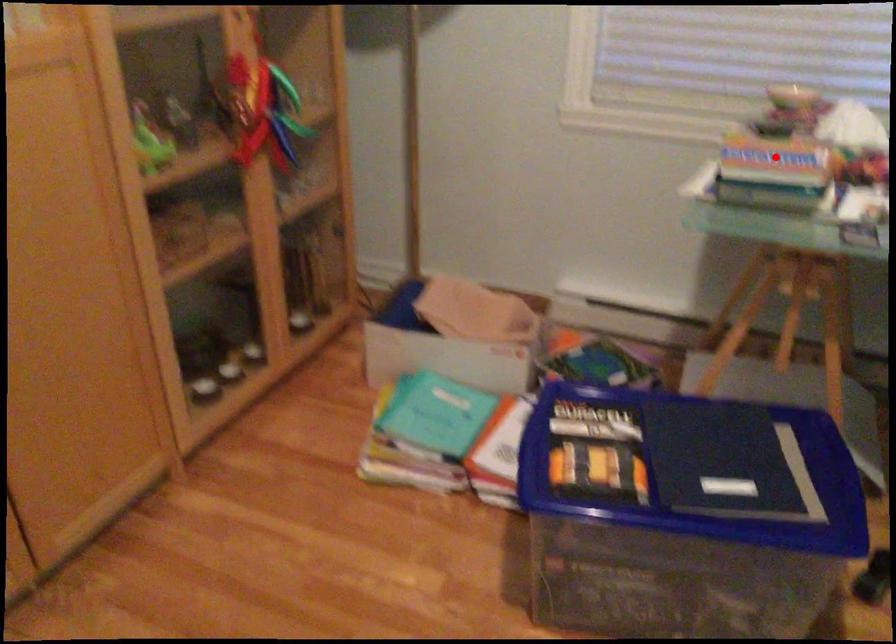
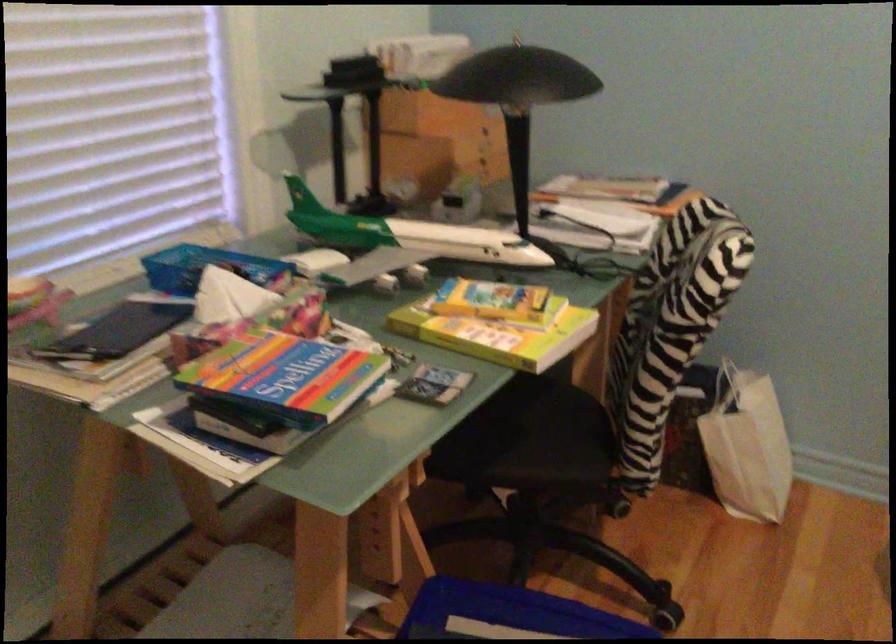
In the second image, find the point that corresponds to the highlighted location in the first image.

(285, 377)